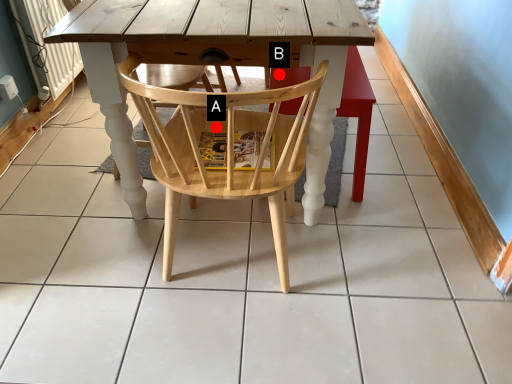
Question: Two points are circled on the image, labeled by A and B beside each circle. Which point is farther from the camera taking this photo?

Choices:
 (A) A is further
 (B) B is further

Answer: (A)